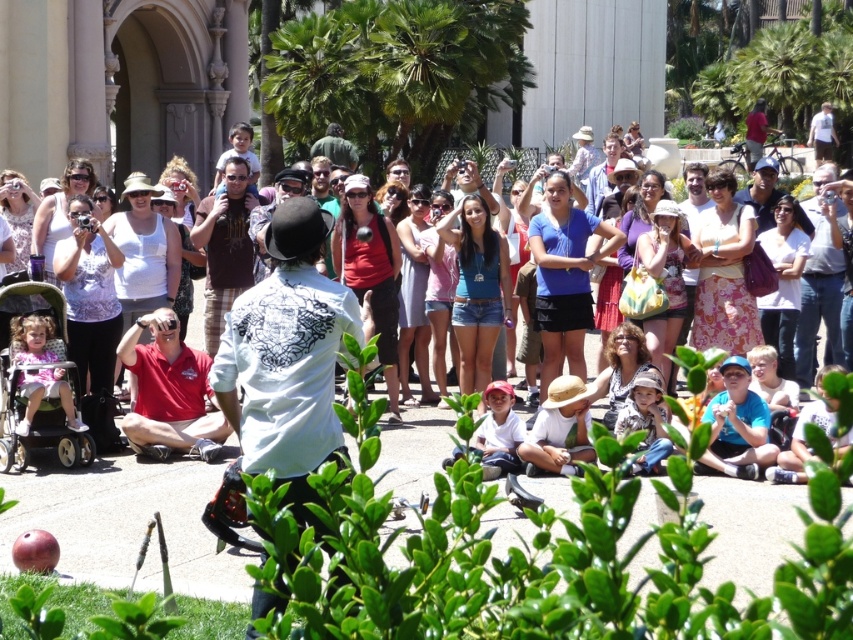
Question: Does matte white shirt at center have a larger size compared to matte black hat at upper center?

Choices:
 (A) no
 (B) yes

Answer: (B)

Question: Does red cotton shirt at center have a lesser width compared to black plastic baby carriage at lower left?

Choices:
 (A) yes
 (B) no

Answer: (B)

Question: Based on their relative distances, which object is nearer to the green fabric hat at center?

Choices:
 (A) brown cotton shirt at center
 (B) matte white shirt at center
 (C) white printed shirt at center
 (D) red cotton shirt at center

Answer: (A)

Question: Which of the following is the farthest from the observer?

Choices:
 (A) (73, 404)
 (B) (236, 465)
 (C) (442, 438)
 (D) (323, 147)

Answer: (D)

Question: Which object is farther from the camera taking this photo?

Choices:
 (A) red cotton shirt at center
 (B) matte white shirt at center
 (C) green fabric hat at center
 (D) black plastic baby carriage at lower left

Answer: (C)

Question: Can you confirm if red cotton shirt at center is bigger than black plastic baby carriage at lower left?

Choices:
 (A) yes
 (B) no

Answer: (A)